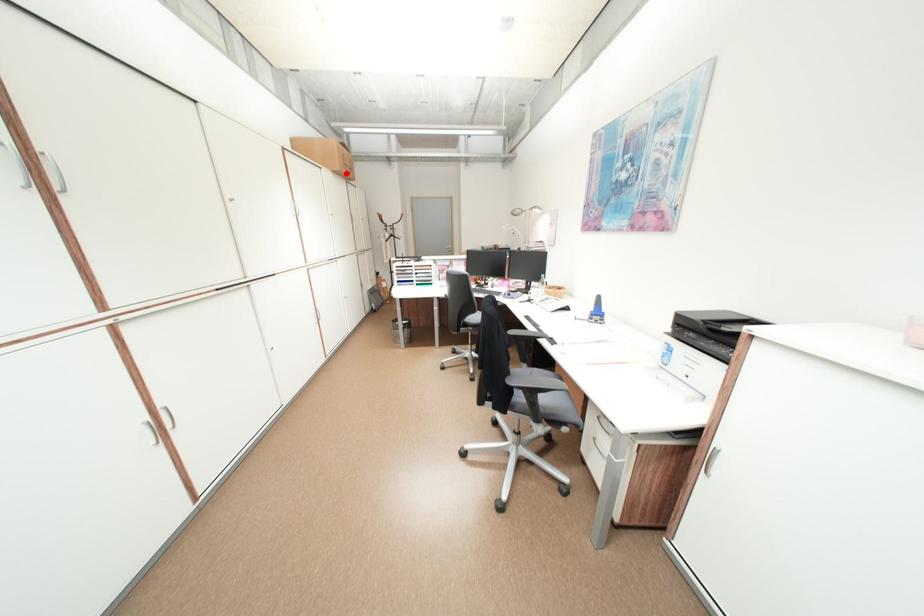
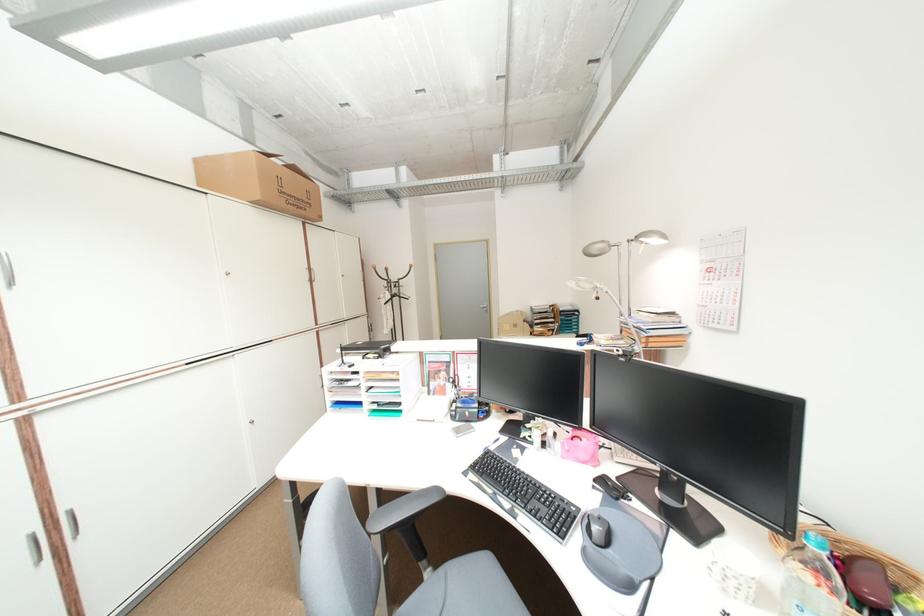
Question: I am providing you with two images of the same scene from different viewpoints. A red point is marked on the first image. At the location where the point appears in image 1, is it still visible in image 2?

Choices:
 (A) Yes
 (B) No

Answer: (A)